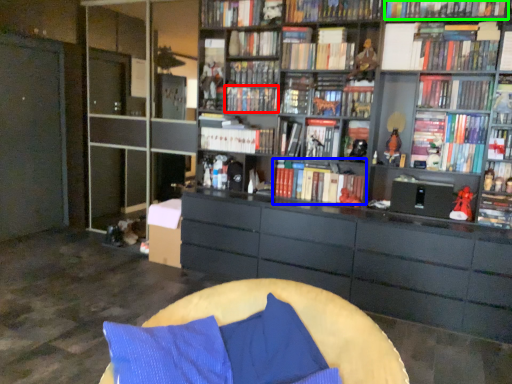
Question: Considering the real-world distances, which object is closest to book (highlighted by a red box)? book (highlighted by a blue box) or book (highlighted by a green box).

Choices:
 (A) book
 (B) book

Answer: (A)